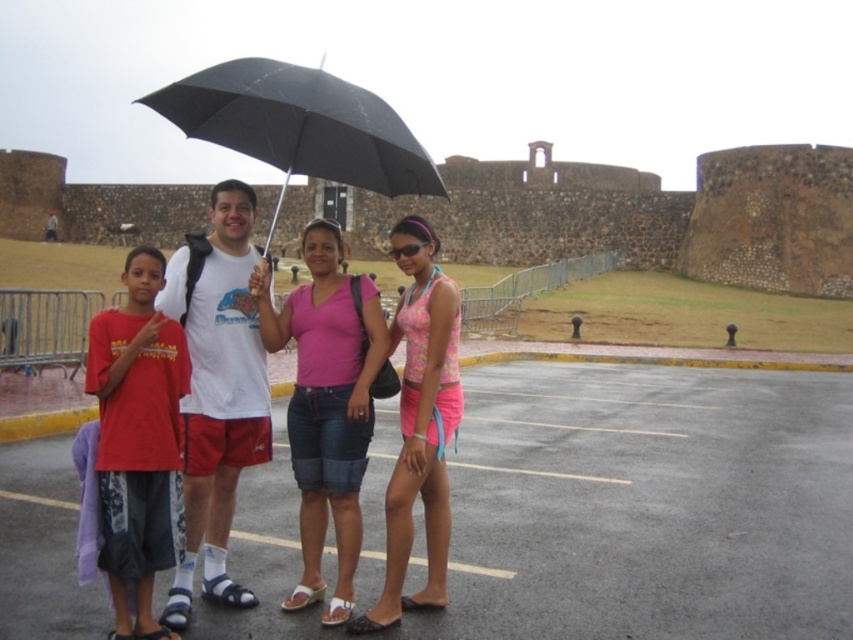
You are a photographer trying to capture a candid shot of the pink fabric shorts at lower left without including the black matte umbrella at upper center in the frame. Based on their positions, is this possible?

The pink fabric shorts at lower left are positioned to the right of the black matte umbrella at upper center. Since the umbrella is above and to the left of the shorts, adjusting the camera angle downward or to the right could exclude the umbrella from the frame while focusing on the shorts.